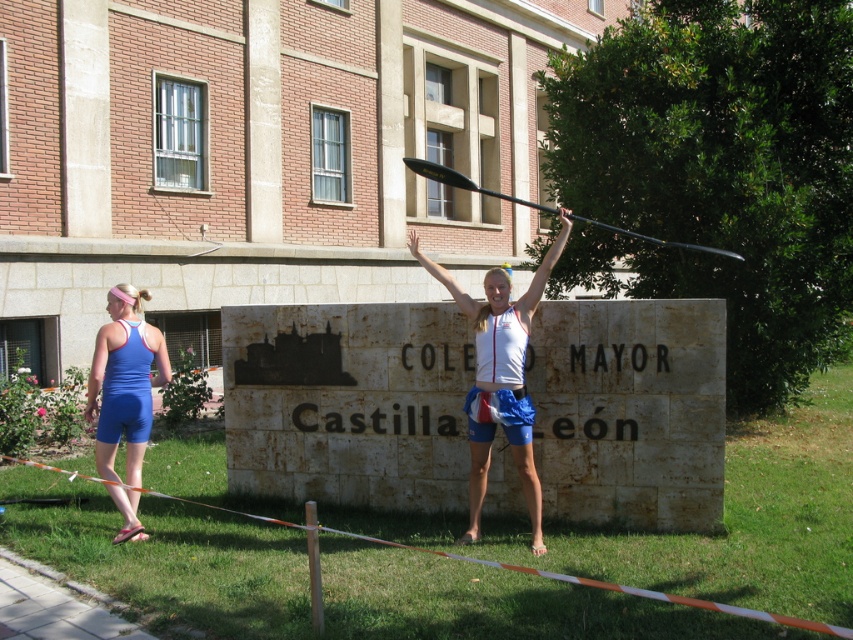
Question: Which point is closer to the camera?

Choices:
 (A) blue fabric shorts at left
 (B) black glossy paddle at upper center

Answer: (B)

Question: Which of these objects is positioned closest to the blonde hair at center?

Choices:
 (A) blue fabric shorts at left
 (B) pink fabric headband at upper left
 (C) black glossy paddle at upper center

Answer: (C)

Question: Considering the real-world distances, which object is closest to the blue fabric shorts at left?

Choices:
 (A) pink fabric headband at upper left
 (B) black glossy paddle at upper center

Answer: (A)

Question: Where is blue fabric shorts at left located in relation to pink fabric headband at upper left in the image?

Choices:
 (A) right
 (B) left

Answer: (A)

Question: Can you confirm if black glossy paddle at upper center is positioned below pink fabric headband at upper left?

Choices:
 (A) no
 (B) yes

Answer: (A)

Question: Can you confirm if black glossy paddle at upper center is bigger than pink fabric headband at upper left?

Choices:
 (A) yes
 (B) no

Answer: (A)